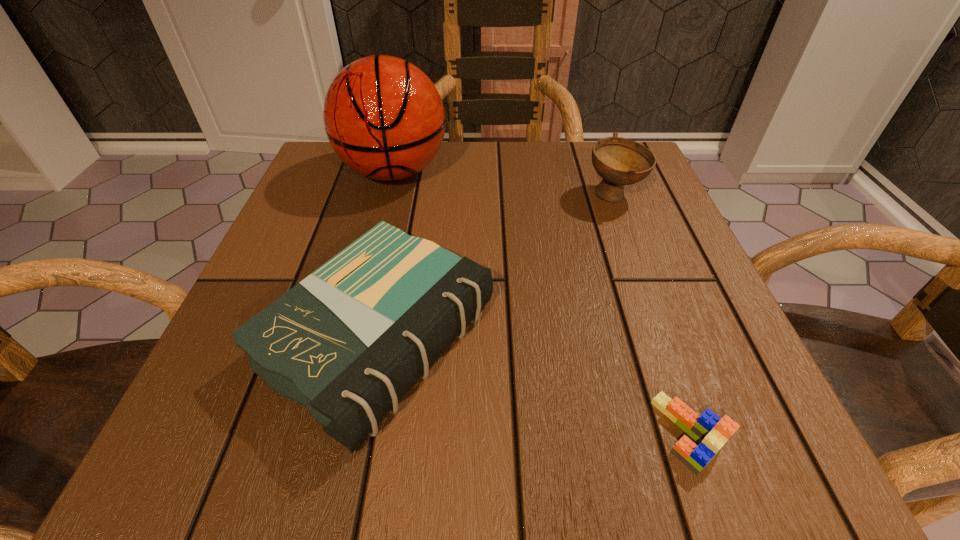
Where is `vacant space at the far edge of the desktop`? The width and height of the screenshot is (960, 540). vacant space at the far edge of the desktop is located at coordinates (430, 188).

Locate an element on the screen. free space at the left edge of the desktop is located at coordinates (324, 225).

The width and height of the screenshot is (960, 540). I want to click on vacant space at the right edge of the desktop, so click(666, 283).

Where is `vacant space at the far left corner of the desktop`? The image size is (960, 540). vacant space at the far left corner of the desktop is located at coordinates 357,177.

Locate an element on the screen. The height and width of the screenshot is (540, 960). empty space that is in between the basketball and the shortest object is located at coordinates (541, 302).

This screenshot has height=540, width=960. In order to click on free area in between the third shortest object and the basketball in this screenshot , I will do `click(504, 184)`.

Find the location of a particular element. free space between the paperback book and the shortest object is located at coordinates (534, 386).

Find the location of a particular element. free space between the soup bowl and the shortest object is located at coordinates (651, 314).

Where is `unoccupied position between the shortest object and the basketball`? unoccupied position between the shortest object and the basketball is located at coordinates (541, 302).

The image size is (960, 540). I want to click on vacant area between the basketball and the Lego, so click(541, 302).